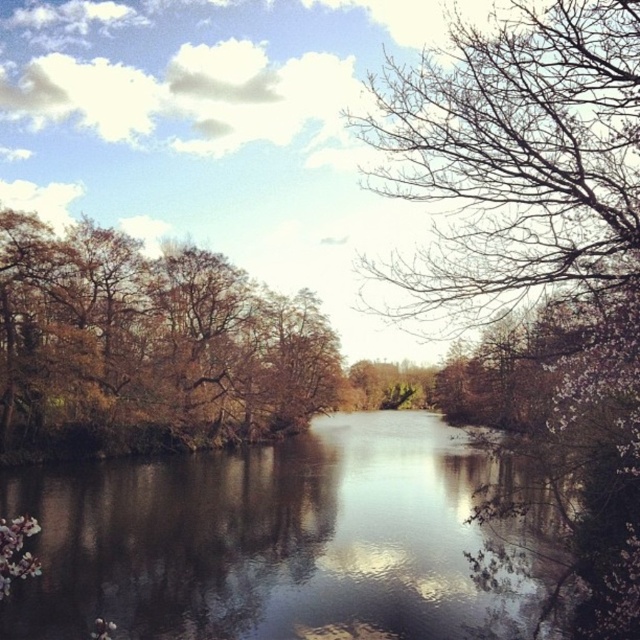
You are planning to take a photo of the brown reflective water at center and the bare branches at upper right. Which object will occupy more space in your photo?

The brown reflective water at center will occupy more space in the photo because it is larger than the bare branches at upper right.

You are standing by the river and want to take a photo of both the bare branches at upper right and the brown leafy trees at left. Which object should you focus on first to ensure both are in clear view?

You should focus on the bare branches at upper right first because it is closer to you than the brown leafy trees at left, so adjusting focus starting from the closer object will help capture both clearly.